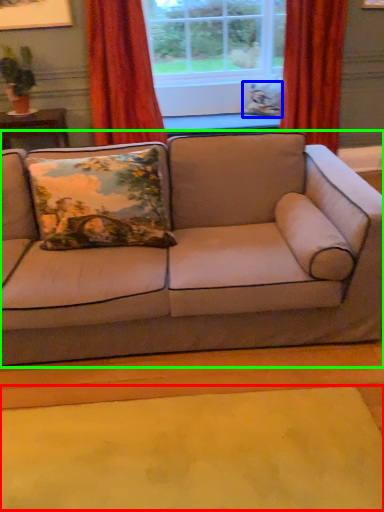
Question: Estimate the real-world distances between objects in this image. Which object is closer to mat (highlighted by a red box), pillow (highlighted by a blue box) or studio couch (highlighted by a green box)?

Choices:
 (A) pillow
 (B) studio couch

Answer: (B)